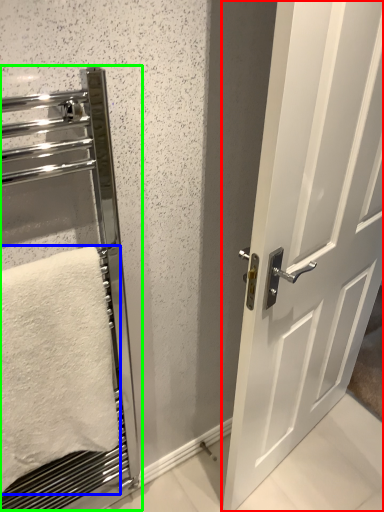
Question: Considering the real-world distances, which object is closest to door (highlighted by a red box)? towel (highlighted by a blue box) or elevator (highlighted by a green box).

Choices:
 (A) towel
 (B) elevator

Answer: (A)